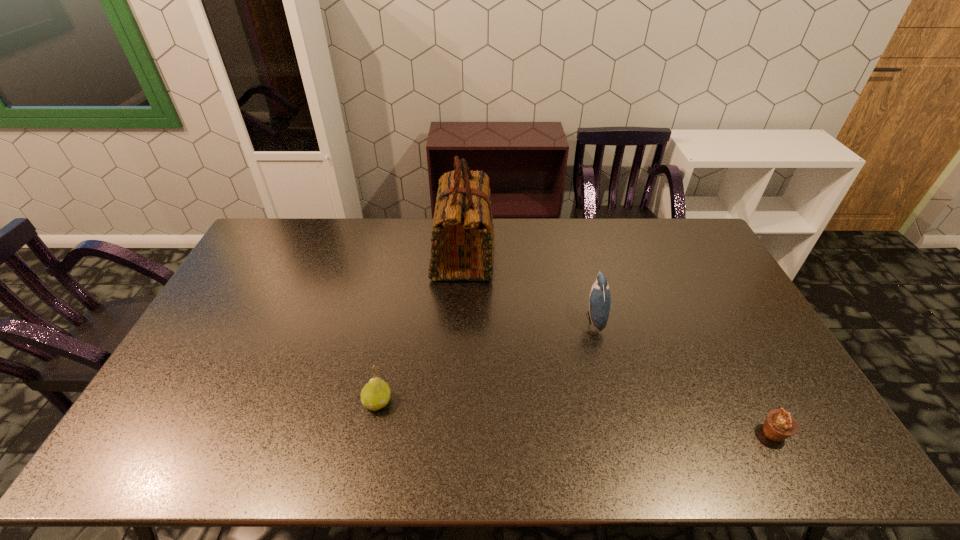
Where is `the second object from left to right`? Image resolution: width=960 pixels, height=540 pixels. the second object from left to right is located at coordinates (462, 248).

Where is `shopping bag`? shopping bag is located at coordinates (462, 248).

Identify the location of bird. The image size is (960, 540). (599, 298).

Find the location of a particular element. Image resolution: width=960 pixels, height=540 pixels. the third object from left to right is located at coordinates (599, 298).

The width and height of the screenshot is (960, 540). Find the location of `pear`. pear is located at coordinates (375, 395).

At what (x,y) coordinates should I click in order to perform the action: click on the second shortest object. Please return your answer as a coordinate pair (x, y). The width and height of the screenshot is (960, 540). Looking at the image, I should click on (x=375, y=395).

Locate an element on the screen. the nearest object is located at coordinates (779, 425).

This screenshot has width=960, height=540. I want to click on muffin, so pos(779,425).

Identify the location of free space located 0.180m on the open handle side of the shopping bag. (545, 254).

At what (x,y) coordinates should I click in order to perform the action: click on free space located at the tip of the third shortest object's beak. Please return your answer as a coordinate pair (x, y). This screenshot has height=540, width=960. Looking at the image, I should click on (563, 319).